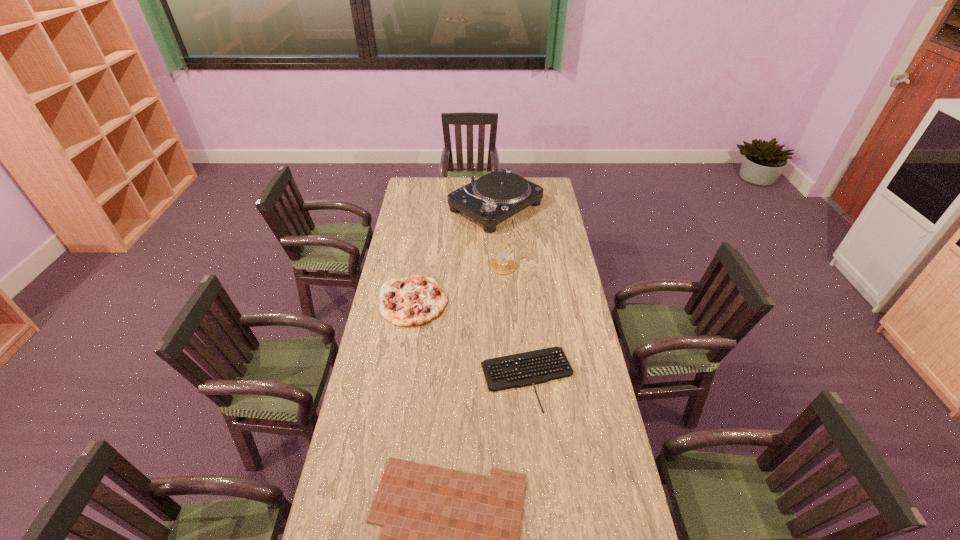
Locate an element on the screen. This screenshot has width=960, height=540. vacant area situated 0.100m on the back of the pizza is located at coordinates (420, 264).

The width and height of the screenshot is (960, 540). What are the coordinates of `vacant region located on the back of the second shortest object` in the screenshot? It's located at (519, 298).

The image size is (960, 540). I want to click on object that is at the far edge, so click(494, 197).

You are a GUI agent. You are given a task and a screenshot of the screen. Output one action in this format:
    pyautogui.click(x=<x>, y=<y>)
    Task: Click on the object that is at the left edge
    This screenshot has height=540, width=960.
    Given the screenshot: What is the action you would take?
    pyautogui.click(x=412, y=301)

The width and height of the screenshot is (960, 540). Find the location of `record player that is at the right edge`. record player that is at the right edge is located at coordinates (494, 197).

Where is `computer keyboard situated at the right edge`? This screenshot has height=540, width=960. computer keyboard situated at the right edge is located at coordinates (535, 367).

Image resolution: width=960 pixels, height=540 pixels. I want to click on object that is at the far right corner, so click(494, 197).

In the image, there is a desktop. At what (x,y) coordinates should I click in order to perform the action: click on vacant area at the left edge. Please return your answer as a coordinate pair (x, y). The width and height of the screenshot is (960, 540). Looking at the image, I should click on (424, 200).

The image size is (960, 540). I want to click on vacant space at the right edge of the desktop, so click(539, 260).

Locate an element on the screen. This screenshot has height=540, width=960. free region at the far right corner of the desktop is located at coordinates (555, 189).